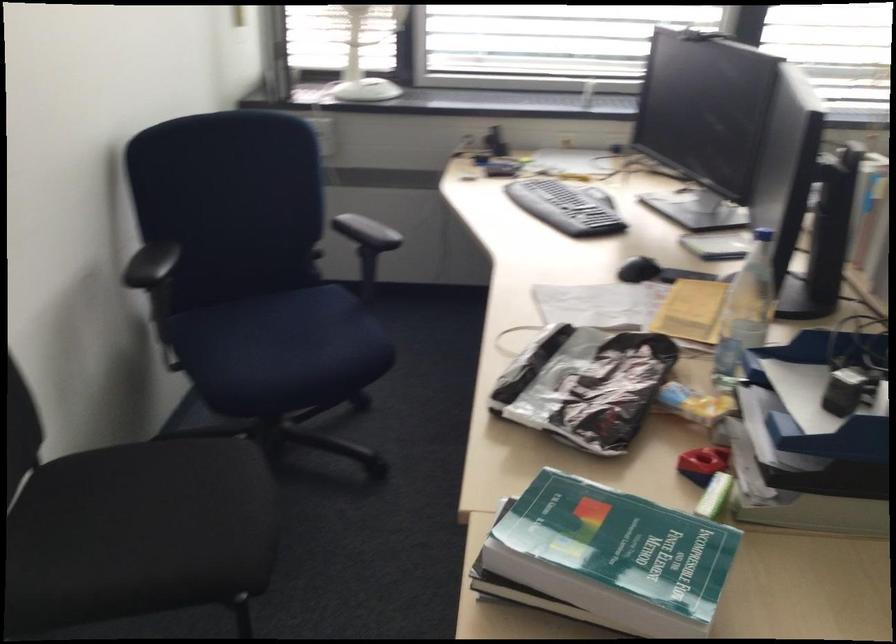
The location [819,395] corresponds to which object?

This point indicates the blue paper tray.